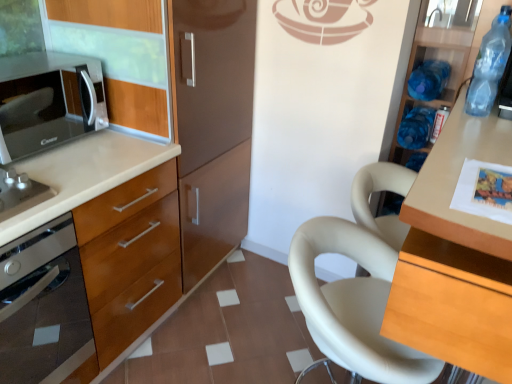
Question: Does point (51, 256) appear closer or farther from the camera than point (422, 87)?

Choices:
 (A) closer
 (B) farther

Answer: (A)

Question: Considering the positions of satin silver oven at left and blue plastic bottle at upper right, the 2th bottle from the front, in the image, is satin silver oven at left taller or shorter than blue plastic bottle at upper right, the 2th bottle from the front,?

Choices:
 (A) tall
 (B) short

Answer: (A)

Question: Which object is positioned farthest from the wooden cabinet at left, which appears as the second cabinetry when viewed from the right?

Choices:
 (A) black glossy microwave at left
 (B) blue plastic bottle at right, the first bottle when ordered from back to front
 (C) light wood table at right, marked as the 1th cabinetry in a right-to-left arrangement
 (D) satin silver oven at left
 (E) white leather chair at center

Answer: (B)

Question: Based on their relative distances, which object is farther from the blue plastic bottle at upper right, the 2th bottle from the front?

Choices:
 (A) white leather chair at center
 (B) wooden cabinet at left, which appears as the second cabinetry when viewed from the right
 (C) satin silver oven at left
 (D) light wood table at right, marked as the 1th cabinetry in a right-to-left arrangement
 (E) black glossy microwave at left

Answer: (C)